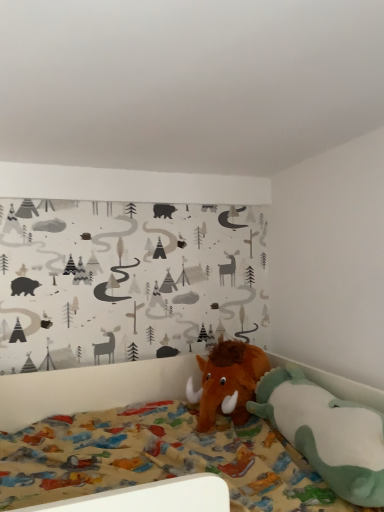
In order to click on brown plush mammoth at center, which is the first toy in back-to-front order in this screenshot , I will do `click(227, 381)`.

The height and width of the screenshot is (512, 384). What do you see at coordinates (227, 381) in the screenshot?
I see `brown plush mammoth at center, which is the first toy in back-to-front order` at bounding box center [227, 381].

How much space does brown plush mammoth at lower right, which is the second toy in back-to-front order, occupy vertically?

9.51 inches.

Describe the element at coordinates (326, 433) in the screenshot. This screenshot has height=512, width=384. I see `brown plush mammoth at lower right, arranged as the first toy when viewed from the front` at that location.

This screenshot has width=384, height=512. In order to click on brown plush mammoth at lower right, which is the second toy in back-to-front order in this screenshot , I will do `click(326, 433)`.

This screenshot has height=512, width=384. What are the coordinates of `brown plush mammoth at center, which is the first toy in back-to-front order` in the screenshot? It's located at pyautogui.click(x=227, y=381).

Based on their positions, is brown plush mammoth at lower right, arranged as the first toy when viewed from the front, located to the left or right of brown plush mammoth at center, which is the first toy in back-to-front order?

From the image, it's evident that brown plush mammoth at lower right, arranged as the first toy when viewed from the front, is to the right of brown plush mammoth at center, which is the first toy in back-to-front order.

Who is more distant, brown plush mammoth at lower right, arranged as the first toy when viewed from the front, or brown plush mammoth at center, which is the first toy in back-to-front order?

brown plush mammoth at center, which is the first toy in back-to-front order, is further from the camera.

Does point (344, 485) come in front of point (237, 407)?

That is True.

From the image's perspective, which is below, brown plush mammoth at lower right, which is the second toy in back-to-front order, or brown plush mammoth at center, which is the second toy from front to back?

brown plush mammoth at lower right, which is the second toy in back-to-front order, appears lower in the image.

From a real-world perspective, which is physically above, brown plush mammoth at lower right, which is the second toy in back-to-front order, or brown plush mammoth at center, which is the first toy in back-to-front order?

brown plush mammoth at center, which is the first toy in back-to-front order.

Considering the relative sizes of brown plush mammoth at lower right, arranged as the first toy when viewed from the front, and brown plush mammoth at center, which is the first toy in back-to-front order, in the image provided, is brown plush mammoth at lower right, arranged as the first toy when viewed from the front, thinner than brown plush mammoth at center, which is the first toy in back-to-front order,?

Yes, brown plush mammoth at lower right, arranged as the first toy when viewed from the front, is thinner than brown plush mammoth at center, which is the first toy in back-to-front order.

Consider the image. Between brown plush mammoth at lower right, arranged as the first toy when viewed from the front, and brown plush mammoth at center, which is the first toy in back-to-front order, which one has less height?

Standing shorter between the two is brown plush mammoth at lower right, arranged as the first toy when viewed from the front.

Looking at the image, does brown plush mammoth at lower right, which is the second toy in back-to-front order, seem bigger or smaller compared to brown plush mammoth at center, which is the second toy from front to back?

brown plush mammoth at lower right, which is the second toy in back-to-front order, is bigger than brown plush mammoth at center, which is the second toy from front to back.

Would you say brown plush mammoth at lower right, which is the second toy in back-to-front order, contains brown plush mammoth at center, which is the first toy in back-to-front order?

No, brown plush mammoth at center, which is the first toy in back-to-front order, is not surrounded by brown plush mammoth at lower right, which is the second toy in back-to-front order.

Is brown plush mammoth at lower right, arranged as the first toy when viewed from the front, not near brown plush mammoth at center, which is the first toy in back-to-front order?

They are positioned close to each other.

Is brown plush mammoth at lower right, arranged as the first toy when viewed from the front, oriented away from brown plush mammoth at center, which is the first toy in back-to-front order?

brown plush mammoth at lower right, arranged as the first toy when viewed from the front, does not have its back to brown plush mammoth at center, which is the first toy in back-to-front order.

What's the angular difference between brown plush mammoth at lower right, arranged as the first toy when viewed from the front, and brown plush mammoth at center, which is the second toy from front to back,'s facing directions?

They differ by 94.6 degrees in their facing directions.

Image resolution: width=384 pixels, height=512 pixels. Find the location of `toy positioned vertically above the brown plush mammoth at lower right, which is the second toy in back-to-front order (from a real-world perspective)`. toy positioned vertically above the brown plush mammoth at lower right, which is the second toy in back-to-front order (from a real-world perspective) is located at coordinates (227, 381).

Does brown plush mammoth at center, which is the first toy in back-to-front order, appear on the left side of brown plush mammoth at lower right, arranged as the first toy when viewed from the front?

Indeed, brown plush mammoth at center, which is the first toy in back-to-front order, is positioned on the left side of brown plush mammoth at lower right, arranged as the first toy when viewed from the front.

Between brown plush mammoth at center, which is the first toy in back-to-front order, and brown plush mammoth at lower right, which is the second toy in back-to-front order, which one is positioned behind?

Positioned behind is brown plush mammoth at center, which is the first toy in back-to-front order.

Does point (230, 406) come behind point (311, 425)?

That is True.

From the image's perspective, is brown plush mammoth at center, which is the first toy in back-to-front order, on top of brown plush mammoth at lower right, which is the second toy in back-to-front order?

Correct, brown plush mammoth at center, which is the first toy in back-to-front order, appears higher than brown plush mammoth at lower right, which is the second toy in back-to-front order, in the image.

From a real-world perspective, is brown plush mammoth at center, which is the first toy in back-to-front order, under brown plush mammoth at lower right, arranged as the first toy when viewed from the front?

Actually, brown plush mammoth at center, which is the first toy in back-to-front order, is physically above brown plush mammoth at lower right, arranged as the first toy when viewed from the front, in the real world.

Between brown plush mammoth at center, which is the second toy from front to back, and brown plush mammoth at lower right, which is the second toy in back-to-front order, which one has larger width?

brown plush mammoth at center, which is the second toy from front to back, is wider.

Which of these two, brown plush mammoth at center, which is the second toy from front to back, or brown plush mammoth at lower right, arranged as the first toy when viewed from the front, stands shorter?

With less height is brown plush mammoth at lower right, arranged as the first toy when viewed from the front.

Based on their sizes in the image, would you say brown plush mammoth at center, which is the first toy in back-to-front order, is bigger or smaller than brown plush mammoth at lower right, which is the second toy in back-to-front order?

brown plush mammoth at center, which is the first toy in back-to-front order, is smaller than brown plush mammoth at lower right, which is the second toy in back-to-front order.

Which is correct: brown plush mammoth at center, which is the second toy from front to back, is inside brown plush mammoth at lower right, arranged as the first toy when viewed from the front, or outside of it?

brown plush mammoth at center, which is the second toy from front to back, is spatially situated outside brown plush mammoth at lower right, arranged as the first toy when viewed from the front.

From the picture: Is brown plush mammoth at center, which is the first toy in back-to-front order, far from brown plush mammoth at lower right, arranged as the first toy when viewed from the front?

No, there isn't a large distance between brown plush mammoth at center, which is the first toy in back-to-front order, and brown plush mammoth at lower right, arranged as the first toy when viewed from the front.

Does brown plush mammoth at center, which is the second toy from front to back, turn towards brown plush mammoth at lower right, which is the second toy in back-to-front order?

Yes, brown plush mammoth at center, which is the second toy from front to back, is oriented towards brown plush mammoth at lower right, which is the second toy in back-to-front order.

How different are the orientations of brown plush mammoth at center, which is the first toy in back-to-front order, and brown plush mammoth at lower right, which is the second toy in back-to-front order, in degrees?

The angle between the facing direction of brown plush mammoth at center, which is the first toy in back-to-front order, and the facing direction of brown plush mammoth at lower right, which is the second toy in back-to-front order, is 94.6 degrees.

The image size is (384, 512). I want to click on toy on the right of brown plush mammoth at center, which is the first toy in back-to-front order, so click(x=326, y=433).

Identify the location of toy directly beneath the brown plush mammoth at center, which is the first toy in back-to-front order (from a real-world perspective). This screenshot has width=384, height=512. (326, 433).

Locate an element on the screen. toy above the brown plush mammoth at lower right, which is the second toy in back-to-front order (from a real-world perspective) is located at coordinates (227, 381).